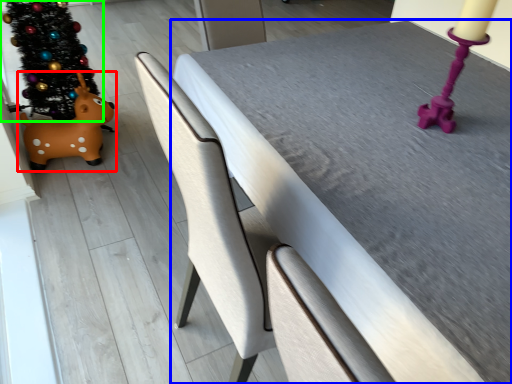
Question: Which is nearer to the toy (highlighted by a red box)? table (highlighted by a blue box) or christmas tree (highlighted by a green box).

Choices:
 (A) table
 (B) christmas tree

Answer: (B)